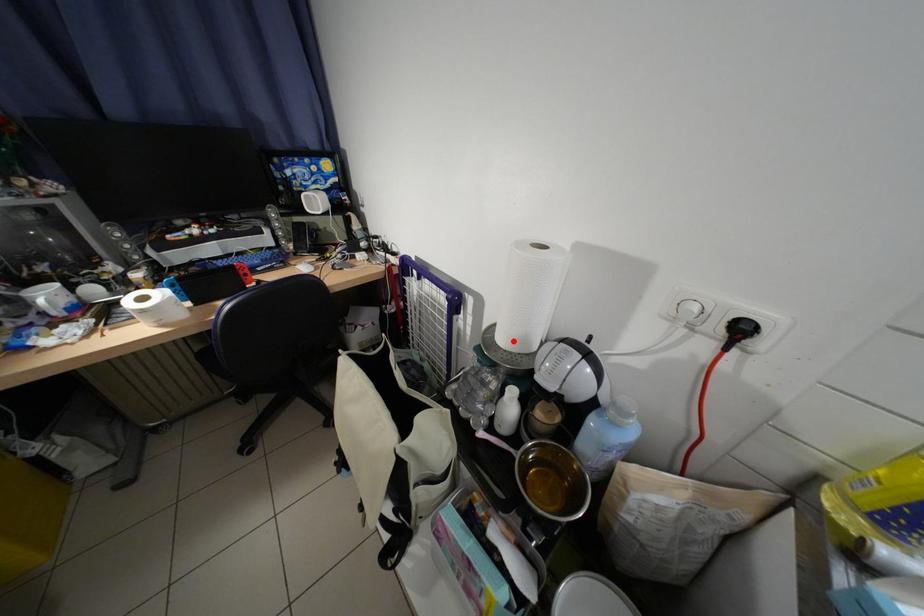
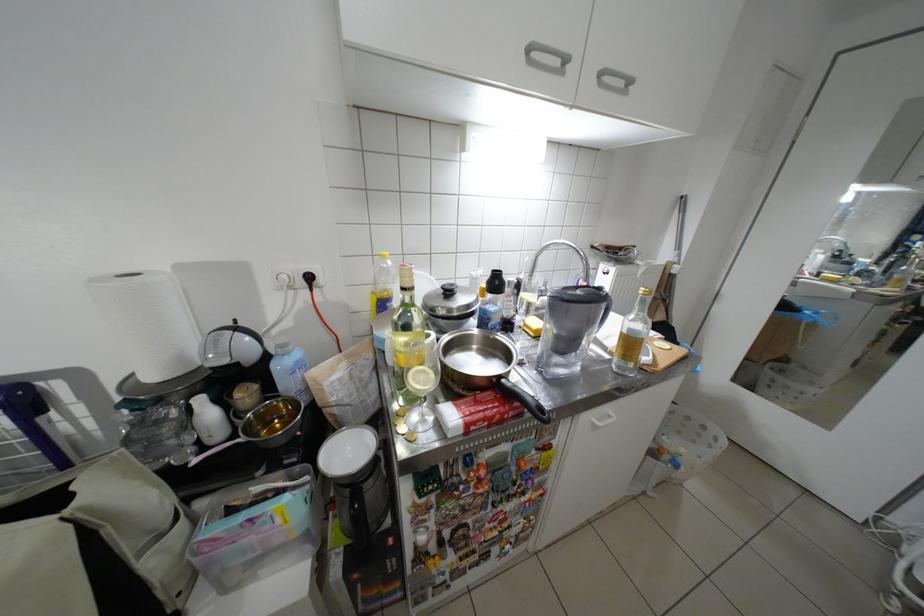
Find the pixel in the second image that matches the highlighted location in the first image.

(164, 378)